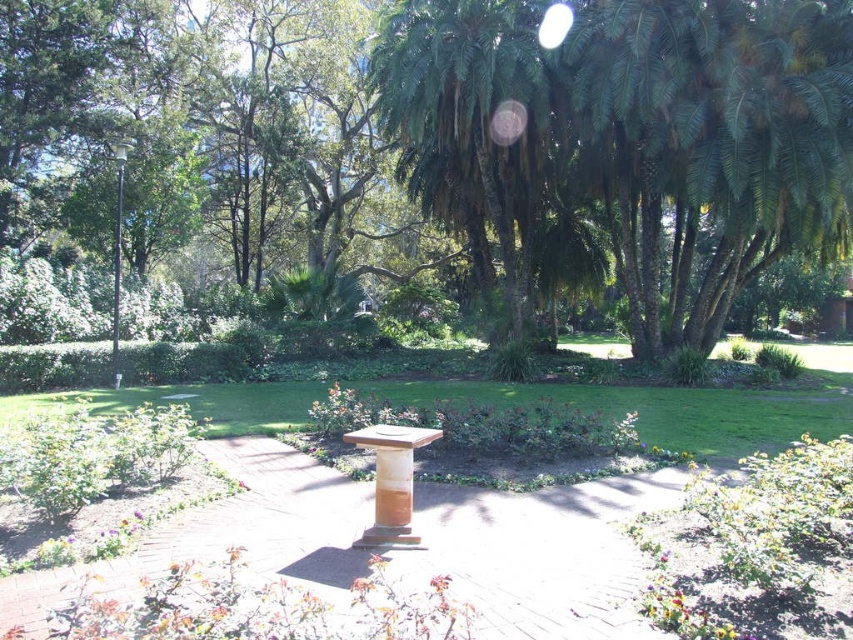
Between point (640, 72) and point (375, 515), which one is positioned in front?

Positioned in front is point (375, 515).

Does green leafy tree at center have a larger size compared to wooden pedestal at center?

Indeed, green leafy tree at center has a larger size compared to wooden pedestal at center.

The height and width of the screenshot is (640, 853). What do you see at coordinates (459, 144) in the screenshot?
I see `green leafy tree at center` at bounding box center [459, 144].

Locate an element on the screen. green leafy tree at center is located at coordinates (459, 144).

Is wooden pedestal at center shorter than black metal pole at left?

Correct, wooden pedestal at center is not as tall as black metal pole at left.

Can you confirm if wooden pedestal at center is wider than black metal pole at left?

Incorrect, wooden pedestal at center's width does not surpass black metal pole at left's.

Is point (402, 518) positioned after point (123, 173)?

No, it is not.

Find the location of `wooden pedestal at center`. wooden pedestal at center is located at coordinates (392, 481).

Is green leafy tree at center smaller than brown wooden path at center?

No.

Which is in front, point (734, 166) or point (473, 552)?

Positioned in front is point (473, 552).

The width and height of the screenshot is (853, 640). Find the location of `green leafy tree at center`. green leafy tree at center is located at coordinates (459, 144).